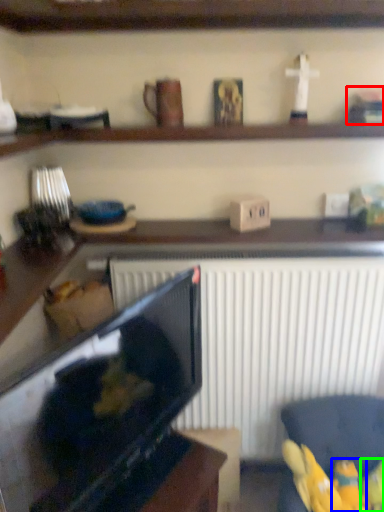
Question: Based on their relative distances, which object is farther from toy (highlighted by a red box)? Choose from toy (highlighted by a blue box) and toy (highlighted by a green box).

Choices:
 (A) toy
 (B) toy

Answer: (B)